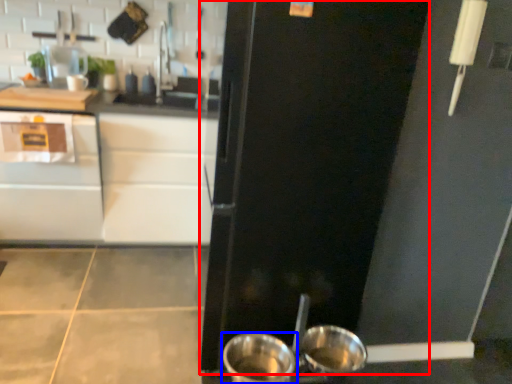
Question: Which of the following is the closest to the observer, door (highlighted by a red box) or kitchen appliance (highlighted by a blue box)?

Choices:
 (A) door
 (B) kitchen appliance

Answer: (A)